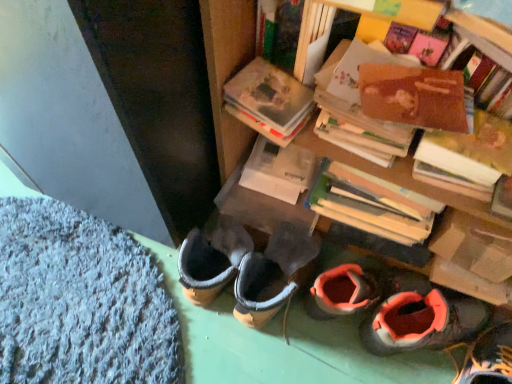
Question: From a real-world perspective, is orange suede boot at lower right, positioned as the 1th footwear in right-to-left order, above or below white matte book at center?

Choices:
 (A) below
 (B) above

Answer: (A)

Question: Looking at their shapes, would you say orange suede boot at lower right, positioned as the 1th footwear in right-to-left order, is wider or thinner than white matte book at center?

Choices:
 (A) thin
 (B) wide

Answer: (B)

Question: Considering the real-world distances, which object is farthest from the orange suede shoes at lower right, acting as the 2th footwear starting from the right?

Choices:
 (A) brown cardboard book at upper right, marked as the first book in a right-to-left arrangement
 (B) orange suede boot at lower right, the 2th footwear positioned from the left
 (C) hardcover book at upper center, the 1th book from the left
 (D) white matte book at center
 (E) blue carpet at lower left

Answer: (C)

Question: Considering the real-world distances, which object is farthest from the hardcover book at upper center, the 1th book from the left?

Choices:
 (A) blue carpet at lower left
 (B) blue textured mat at lower left
 (C) orange suede shoes at lower right, acting as the 2th footwear starting from the right
 (D) wooden bookshelf at upper right
 (E) orange suede boot at lower right, positioned as the 1th footwear in right-to-left order

Answer: (E)